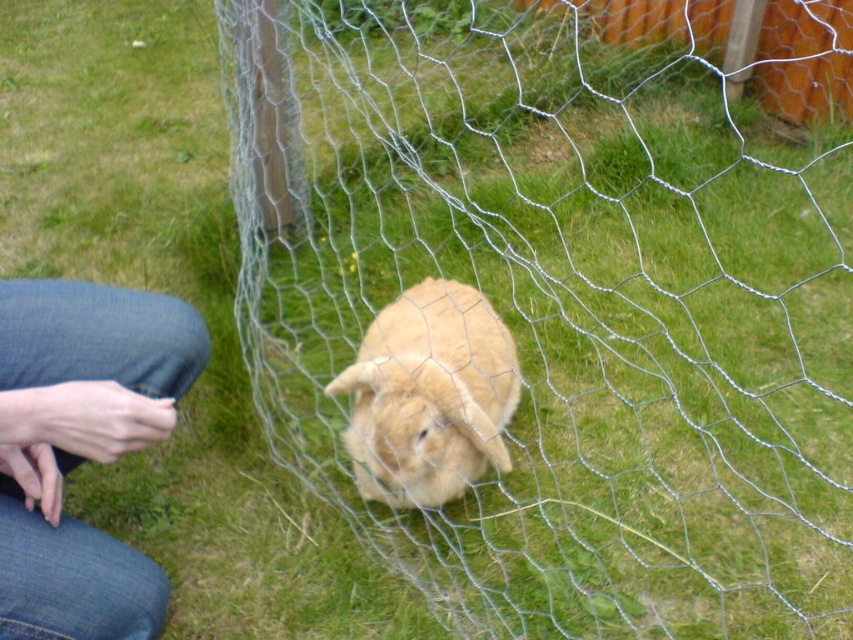
You are taking a photo of the scene and want to focus on both the rabbit and the wooden posts of the wire mesh fence. The rabbit is at point (624, 394) and the wooden posts are at point (392, 333). Which point should you adjust your focus to first to ensure both are in focus?

Point (624, 394) is further to the camera than point (392, 333). To ensure both are in focus, you should adjust your focus to the point that is closer to the camera first, which is point (392, 333).

You are standing in the scene and want to reach the rabbit behind the wire mesh fence at center. What obstacle must you navigate around or through to get to the rabbit?

The wire mesh fence at center is located at point (549, 310), so you must navigate around or through the wire mesh fence at center to reach the rabbit.